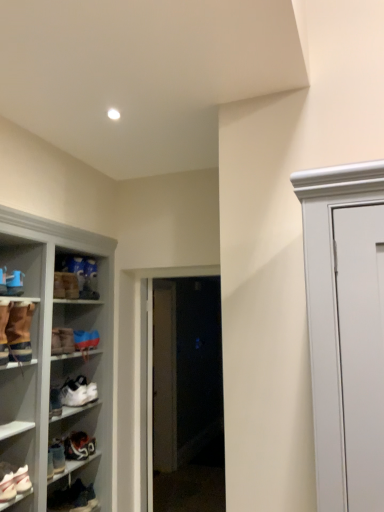
Question: Considering the relative positions of brown suede boot at left, placed as the 3th footwear when sorted from top to bottom, and white leather sneakers at lower left, the 6th footwear positioned from the top, in the image provided, is brown suede boot at left, placed as the 3th footwear when sorted from top to bottom, to the left of white leather sneakers at lower left, the 6th footwear positioned from the top, from the viewer's perspective?

Choices:
 (A) yes
 (B) no

Answer: (B)

Question: Does brown suede boot at left, placed as the 3th footwear when sorted from top to bottom, have a lesser width compared to white leather sneakers at lower left, the 6th footwear positioned from the top?

Choices:
 (A) yes
 (B) no

Answer: (A)

Question: Does brown suede boot at left, the sixth footwear positioned from the bottom, have a greater width compared to white leather sneakers at lower left, arranged as the third footwear when ordered from the bottom?

Choices:
 (A) no
 (B) yes

Answer: (A)

Question: Does brown suede boot at left, the sixth footwear positioned from the bottom, have a lesser height compared to white leather sneakers at lower left, arranged as the third footwear when ordered from the bottom?

Choices:
 (A) yes
 (B) no

Answer: (B)

Question: From a real-world perspective, is brown suede boot at left, the sixth footwear positioned from the bottom, physically below white leather sneakers at lower left, arranged as the third footwear when ordered from the bottom?

Choices:
 (A) yes
 (B) no

Answer: (B)

Question: From a real-world perspective, does brown suede boot at left, placed as the 3th footwear when sorted from top to bottom, stand above white leather sneakers at lower left, the 6th footwear positioned from the top?

Choices:
 (A) yes
 (B) no

Answer: (A)

Question: Is brown suede boot at left, placed as the 3th footwear when sorted from top to bottom, completely or partially outside of white leather sneaker at lower left, which appears as the 2th footwear when ordered from the bottom?

Choices:
 (A) yes
 (B) no

Answer: (A)

Question: Is the surface of brown suede boot at left, placed as the 3th footwear when sorted from top to bottom, in direct contact with white leather sneaker at lower left, which appears as the 2th footwear when ordered from the bottom?

Choices:
 (A) no
 (B) yes

Answer: (A)

Question: Is brown suede boot at left, placed as the 3th footwear when sorted from top to bottom, further to camera compared to white leather sneaker at lower left, which is the seventh footwear in top-to-bottom order?

Choices:
 (A) no
 (B) yes

Answer: (A)

Question: Is brown suede boot at left, the sixth footwear positioned from the bottom, thinner than white leather sneaker at lower left, which is the seventh footwear in top-to-bottom order?

Choices:
 (A) yes
 (B) no

Answer: (A)

Question: Is brown suede boot at left, placed as the 3th footwear when sorted from top to bottom, bigger than white leather sneaker at lower left, which appears as the 2th footwear when ordered from the bottom?

Choices:
 (A) yes
 (B) no

Answer: (A)

Question: Is white leather sneaker at lower left, which appears as the 2th footwear when ordered from the bottom, completely or partially inside brown suede boot at left, the sixth footwear positioned from the bottom?

Choices:
 (A) no
 (B) yes

Answer: (A)

Question: From the image's perspective, is matte brown boot at upper left, the seventh footwear in the bottom-to-top sequence, under brown suede boot at left, placed as the 3th footwear when sorted from top to bottom?

Choices:
 (A) no
 (B) yes

Answer: (A)